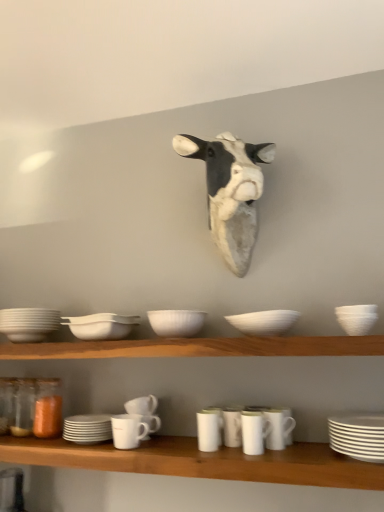
Question: Do you think white matte bowl at center, the second tableware positioned from the left, is within wooden shelf at center, or outside of it?

Choices:
 (A) inside
 (B) outside

Answer: (B)

Question: Considering the positions of point (92, 338) and point (11, 345), is point (92, 338) closer or farther from the camera than point (11, 345)?

Choices:
 (A) closer
 (B) farther

Answer: (A)

Question: Which is farther from the white matte bowl at center, the second tableware positioned from the left?

Choices:
 (A) white glossy mug at center, which is the 4th tableware in right-to-left order
 (B) white matte bowl at upper right, placed as the tenth tableware when sorted from left to right
 (C) white matte mug at lower center, the 5th tableware when ordered from left to right
 (D) translucent orange glass jar at lower left
 (E) white matte cup at center, which appears as the 6th tableware when viewed from the left

Answer: (B)

Question: Estimate the real-world distances between objects in this image. Which object is closer to the translucent orange glass jar at lower left?

Choices:
 (A) wooden shelf at center
 (B) white matte bowl at upper right, placed as the tenth tableware when sorted from left to right
 (C) white glossy mug at center, which appears as the seventh tableware when viewed from the left
 (D) white matte bowl at left, the first tableware when ordered from left to right
 (E) white matte mug at lower center, marked as the eighth tableware in a right-to-left arrangement

Answer: (D)